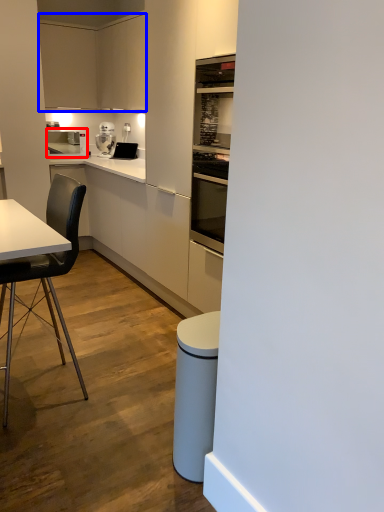
Question: Among these objects, which one is nearest to the camera, kitchen appliance (highlighted by a red box) or cabinetry (highlighted by a blue box)?

Choices:
 (A) kitchen appliance
 (B) cabinetry

Answer: (B)